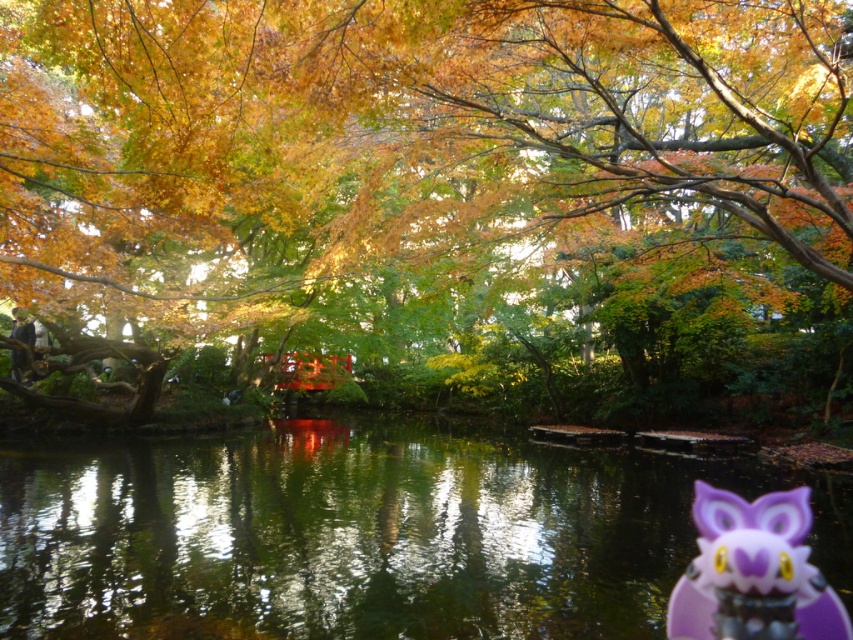
You are a photographer planning to capture the autumnal Japanese garden scene. You have a camera with a wide angle lens that can capture 2 meters in width. You need to include both the green reflective water at center and the purple plastic owl at lower right in your shot. Can you fit both objects within the camera lens width?

The green reflective water at center is wider than the purple plastic owl at lower right. Since the camera lens can capture 2 meters in width, and the combined width of both objects may exceed this limit, it depends on their exact dimensions. However, since the green reflective water at center is wider, if its width alone is under 2 meters, it might be possible to frame both within the lens. Without specific measurements, it is uncertain.

You are a photographer wanting to capture the purple plastic owl at lower right and the green reflective water at center in your shot. Which object will appear bigger in the photo?

The green reflective water at center will appear bigger in the photo because it is larger in size than the purple plastic owl at lower right.